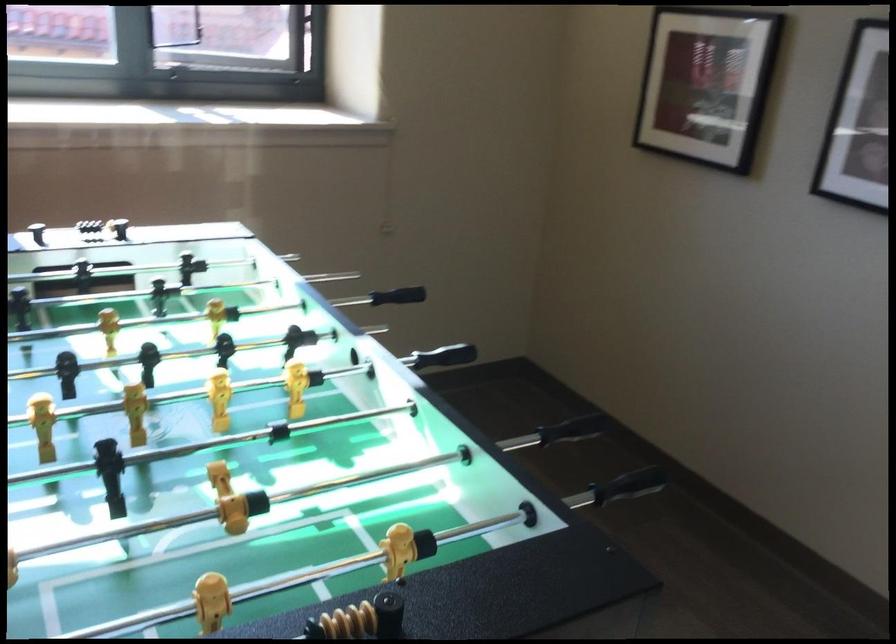
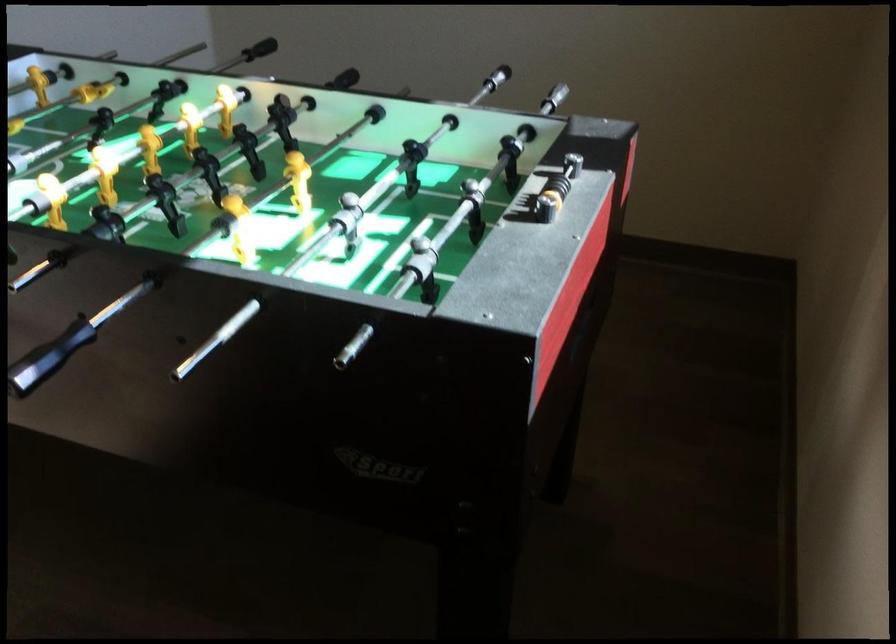
Where in the second image is the point corresponding to [78,232] from the first image?

(556, 185)